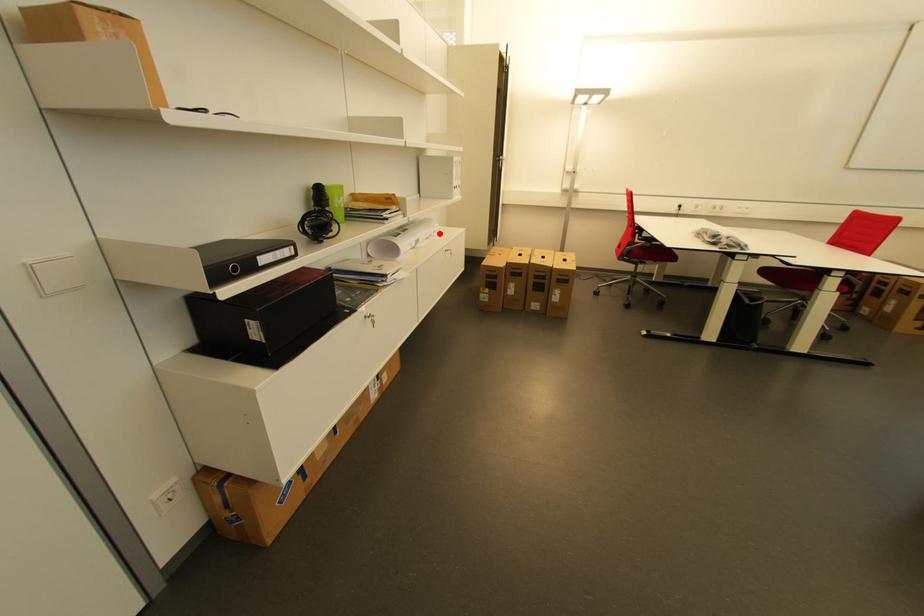
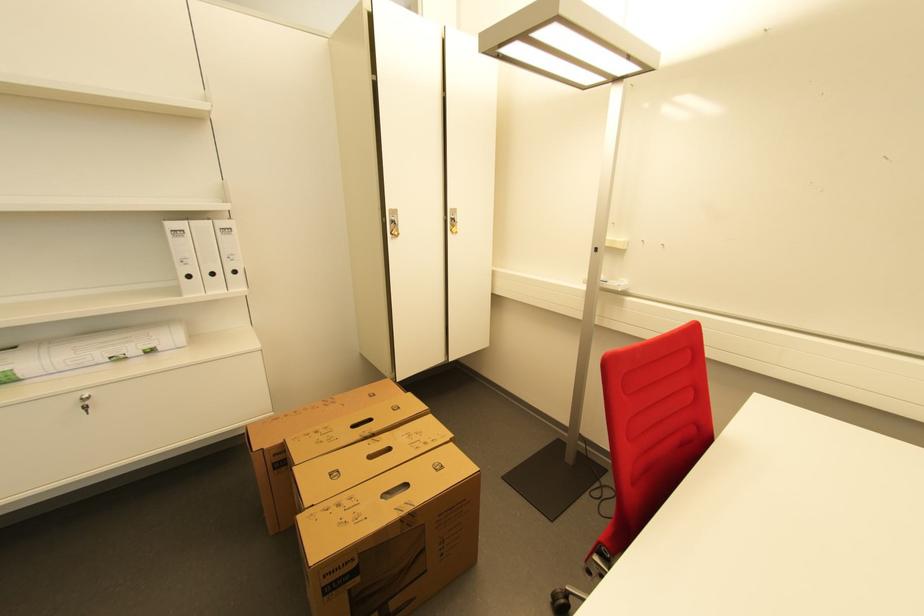
The point at the highlighted location is marked in the first image. Where is the corresponding point in the second image?

(155, 352)